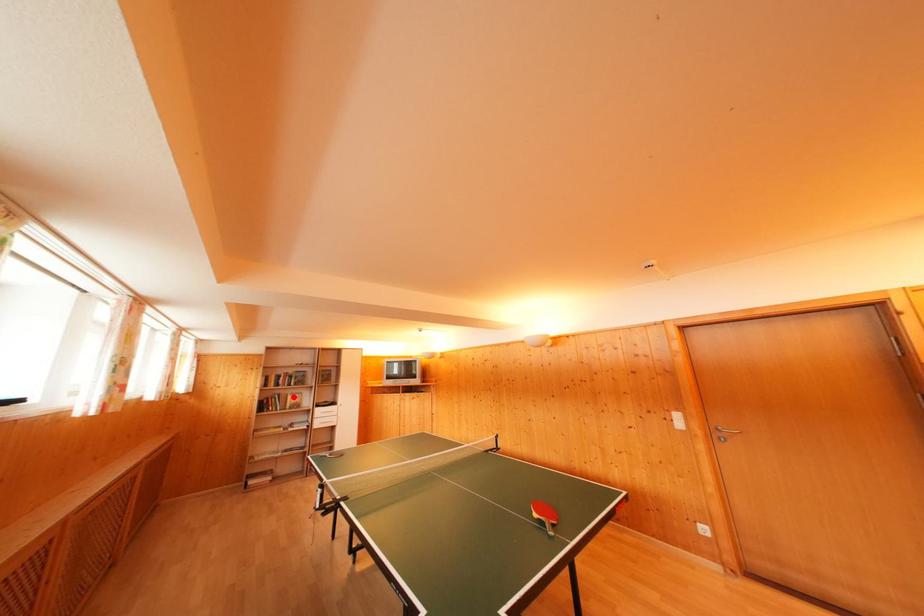
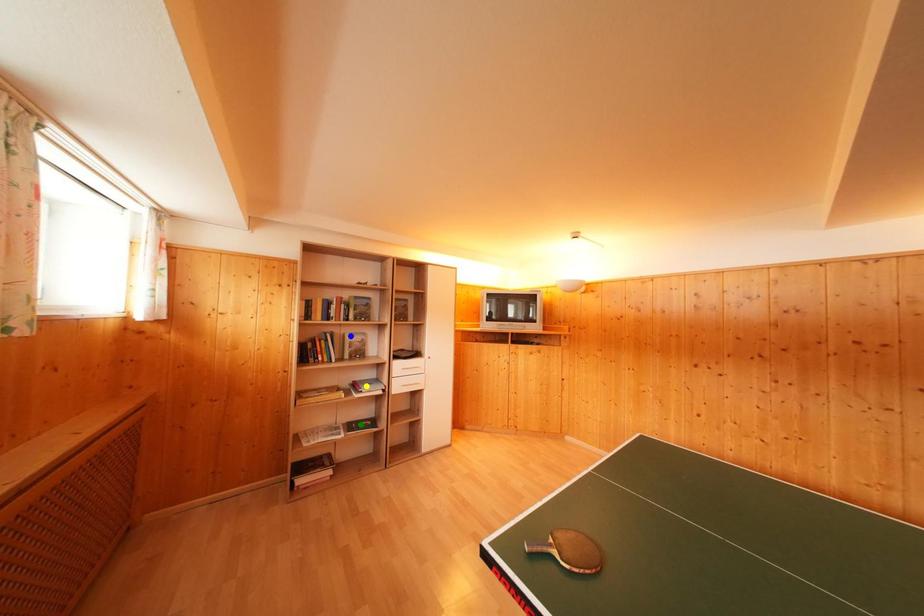
Question: I am providing you with two images of the same scene from different viewpoints. A red point is marked on the first image. You are given multiple points on the second image. Which spot in image 2 lines up with the point in image 1?

Choices:
 (A) blue point
 (B) yellow point
 (C) green point

Answer: (A)